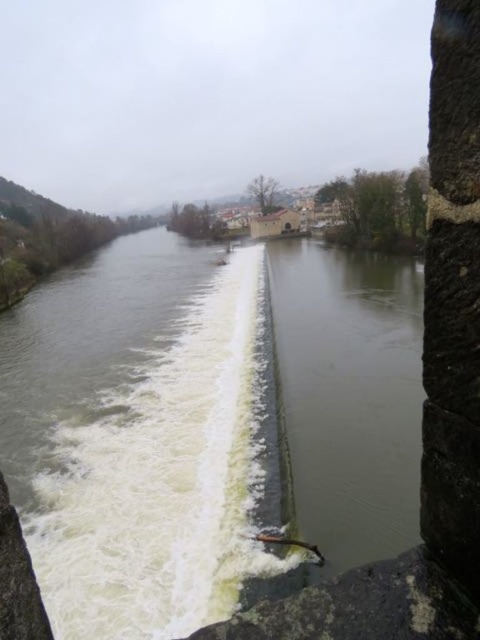
You are a drone operator trying to capture a photo of the greenish concrete river at center. You are currently positioned at the point marked by coordinates point (91, 403). Can you confirm if you are directly above the greenish concrete river at center?

The point marked by coordinates point (91, 403) marks the greenish concrete river at center, so yes, you are directly above the greenish concrete river at center.

You are a drone operator trying to navigate between two points marked in the river scene. The first point is at coordinate point [335,292] and the second is at point [373,451]. From your vantage point above the river, which point is closer to you?

Point [335,292] is behind point [373,451], so the second point at [373,451] is closer to you.

You are a kayaker planning to navigate the river shown in the image. You see the greenish concrete river at center and the greenish concrete dam at center. Which one should you avoid due to potential hazards?

The greenish concrete river at center is above the greenish concrete dam at center, so the area around the dam may have strong currents and turbulent water, making it a potential hazard to avoid.